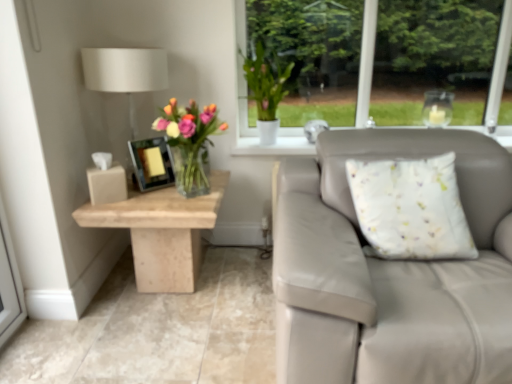
Identify the location of free region under translucent glass vase at center (from a real-world perspective). (195, 194).